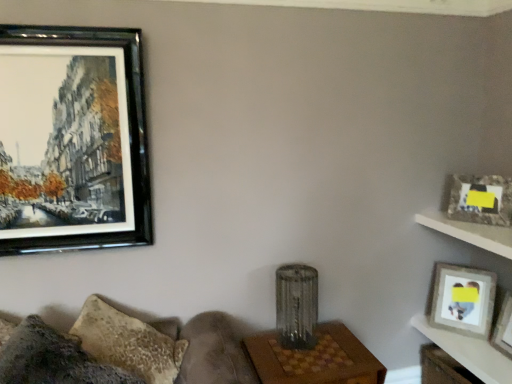
This screenshot has width=512, height=384. What are the coordinates of `empty space that is ontop of black glossy picture frame at upper left, which is the first picture frame in left-to-right order` in the screenshot? It's located at (66, 28).